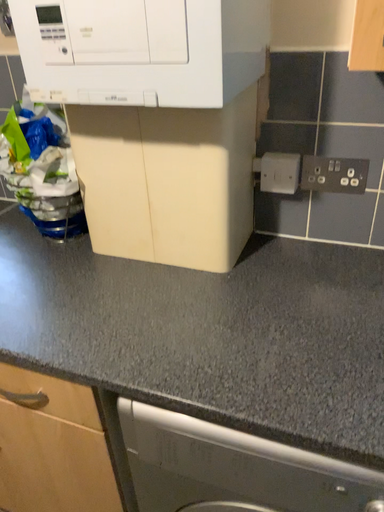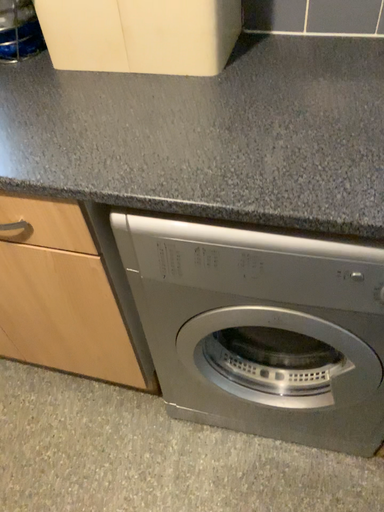
Question: Which way did the camera rotate in the video?

Choices:
 (A) rotated upward
 (B) rotated downward

Answer: (B)